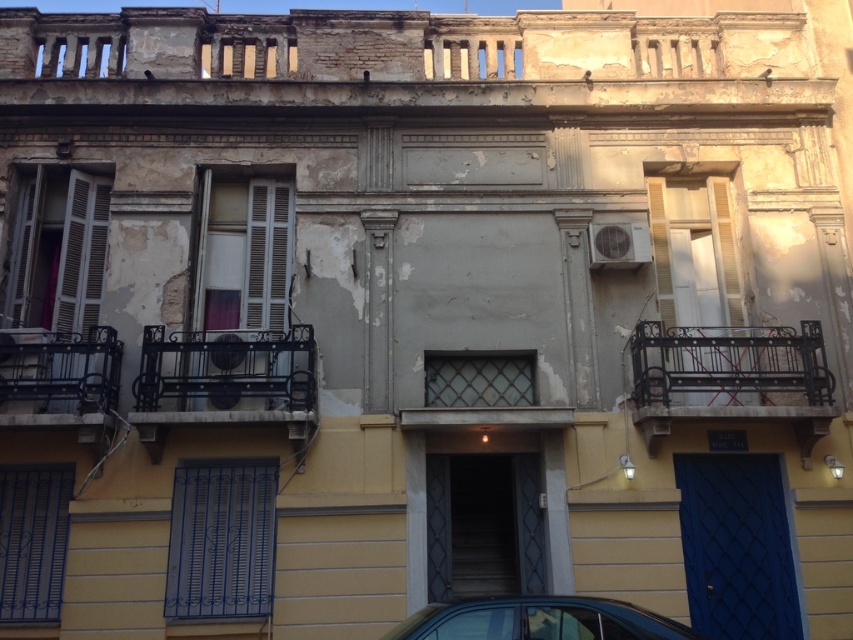
You are standing in front of the building and want to enter through the blue door. To your left, you see the matte gray shutters at left and the black wrought iron balcony at center. Which object is closer to you as you face the building?

The matte gray shutters at left are closer to you because the black wrought iron balcony at center is positioned behind them.

You are standing in front of the building and want to enter through the blue door with diamond patterns. To reach it, you need to pass under the black wrought iron balcony at left. Is the white wooden shutter at center in your way?

The white wooden shutter at center is above the black wrought iron balcony at left, so it is not in your way when approaching the blue door with diamond patterns.